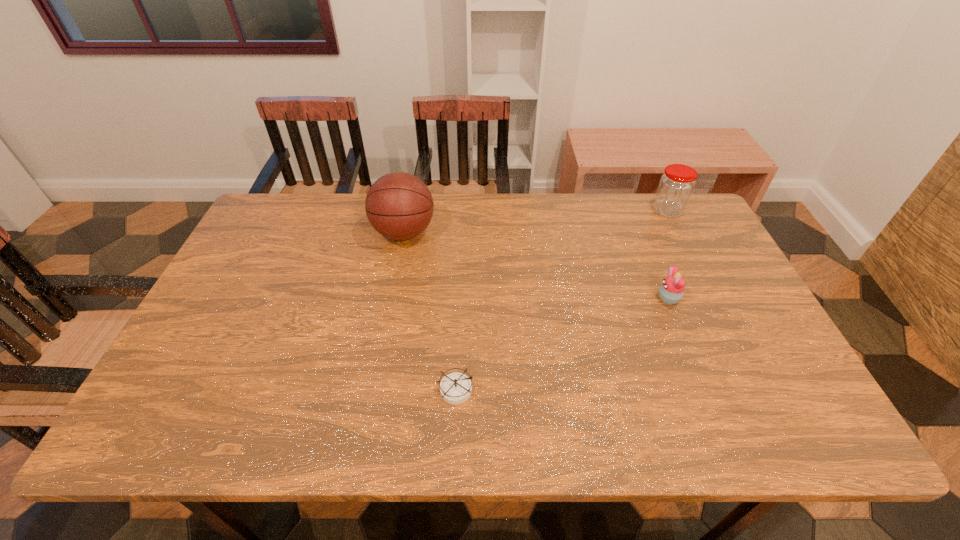
Locate an element on the screen. The width and height of the screenshot is (960, 540). free space between the compass and the third tallest object is located at coordinates coord(562,345).

Identify the location of free space between the nearest object and the rightmost object. (561, 301).

Identify the location of free space between the basketball and the compass. (x=429, y=312).

Locate which object is the closest to the basketball. Please provide its 2D coordinates. Your answer should be formatted as a tuple, i.e. [(x, y)], where the tuple contains the x and y coordinates of a point satisfying the conditions above.

[(455, 388)]

What are the coordinates of `object identified as the third closest to the compass` in the screenshot? It's located at (676, 185).

You are a GUI agent. You are given a task and a screenshot of the screen. Output one action in this format:
    pyautogui.click(x=<x>, y=<y>)
    Task: Click on the free space that satisfies the following two spatial constraints: 1. on the back side of the compass; 2. on the left side of the second tallest object
    
    Given the screenshot: What is the action you would take?
    pyautogui.click(x=463, y=211)

Where is `blank area in the image that satisfies the following two spatial constraints: 1. on the front side of the jar; 2. on the face of the third object from left to right`? This screenshot has width=960, height=540. blank area in the image that satisfies the following two spatial constraints: 1. on the front side of the jar; 2. on the face of the third object from left to right is located at coordinates (711, 298).

Locate an element on the screen. This screenshot has width=960, height=540. free space that satisfies the following two spatial constraints: 1. on the front side of the tallest object; 2. on the right side of the third object from right to left is located at coordinates (373, 390).